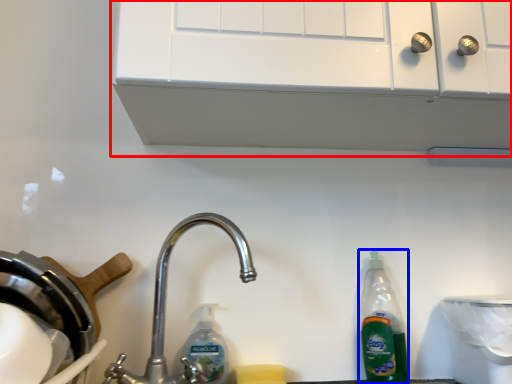
Question: Which of the following is the farthest to the observer, vent (highlighted by a red box) or bottle (highlighted by a blue box)?

Choices:
 (A) vent
 (B) bottle

Answer: (B)